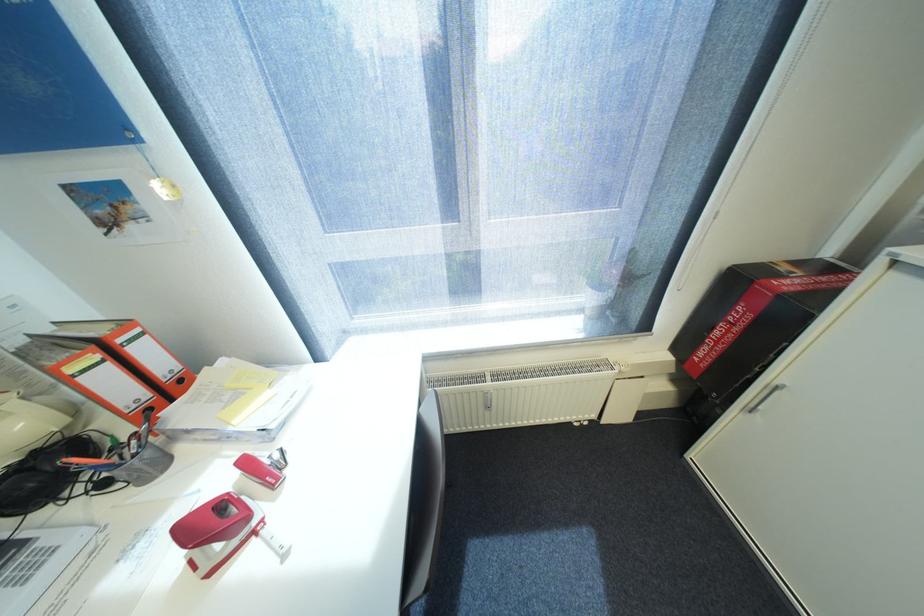
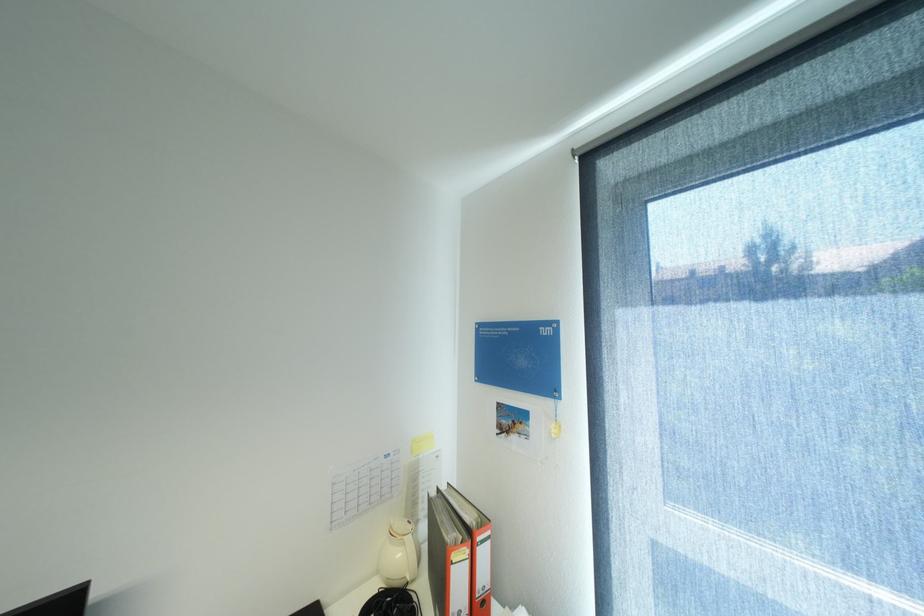
Where in the second image is the point corresponding to pixel 173 381 from the first image?

(484, 597)